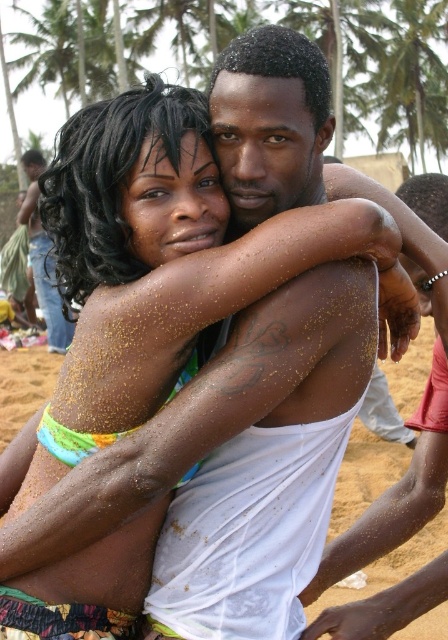
Does smooth white shirt at center lie in front of sandy skin at center?

Yes, smooth white shirt at center is in front of sandy skin at center.

Can you confirm if smooth white shirt at center is bigger than sandy skin at center?

No.

Does point (409, 589) lie behind point (57, 337)?

No, it is in front of (57, 337).

Where is `smooth white shirt at center`? smooth white shirt at center is located at coordinates (399, 490).

How distant is smooth white shirt at center from green leafy palm tree at upper center?

smooth white shirt at center is 54.81 meters away from green leafy palm tree at upper center.

Which is above, smooth white shirt at center or green leafy palm tree at upper center?

green leafy palm tree at upper center is higher up.

Consider the image. Who is more distant from viewer, (430, 486) or (392, 10)?

The point (392, 10) is behind.

Locate an element on the screen. This screenshot has height=640, width=448. smooth white shirt at center is located at coordinates (399, 490).

Is green leafy palm tree at upper center positioned behind sandy skin at center?

Yes.

This screenshot has height=640, width=448. I want to click on green leafy palm tree at upper center, so click(410, 77).